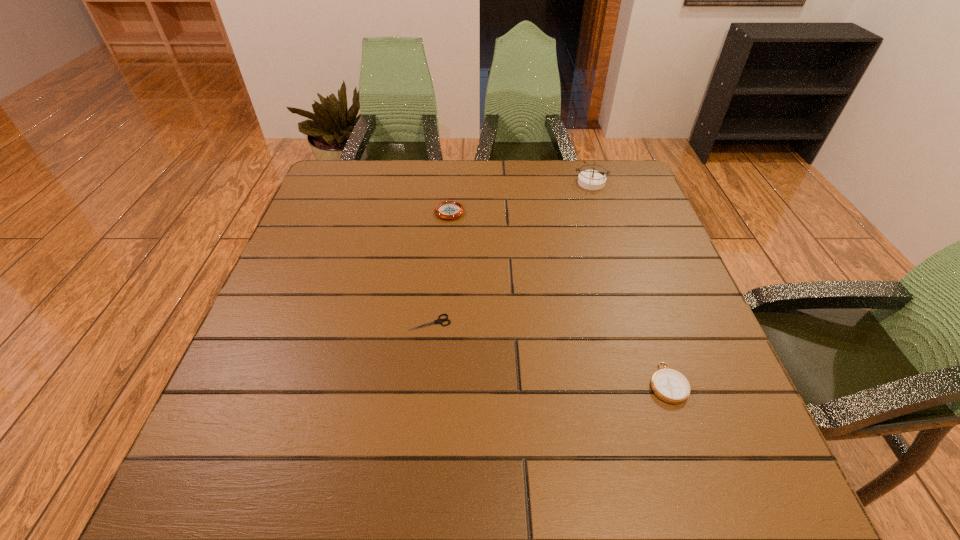
At what (x,y) coordinates should I click in order to perform the action: click on the farthest object. Please return your answer as a coordinate pair (x, y). The image size is (960, 540). Looking at the image, I should click on [589, 179].

This screenshot has width=960, height=540. I want to click on the tallest object, so click(589, 179).

This screenshot has width=960, height=540. I want to click on the second nearest compass, so click(448, 209).

Locate an element on the screen. The width and height of the screenshot is (960, 540). the third nearest object is located at coordinates (448, 209).

The height and width of the screenshot is (540, 960). I want to click on the nearest object, so click(x=669, y=385).

I want to click on shears, so [439, 321].

The width and height of the screenshot is (960, 540). I want to click on the second nearest object, so click(x=439, y=321).

Where is `free region located 0.130m on the front of the farthest object`? free region located 0.130m on the front of the farthest object is located at coordinates (602, 219).

I want to click on vacant space located 0.140m on the left of the second farthest compass, so click(x=385, y=211).

Where is `vacant area situated 0.280m on the left of the nearest object`? The height and width of the screenshot is (540, 960). vacant area situated 0.280m on the left of the nearest object is located at coordinates (502, 383).